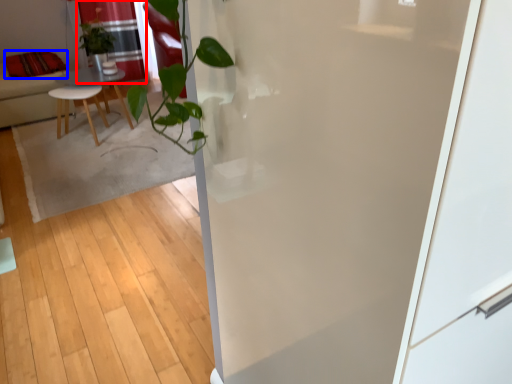
Question: Among these objects, which one is farthest to the camera, curtain (highlighted by a red box) or pillow (highlighted by a blue box)?

Choices:
 (A) curtain
 (B) pillow

Answer: (A)